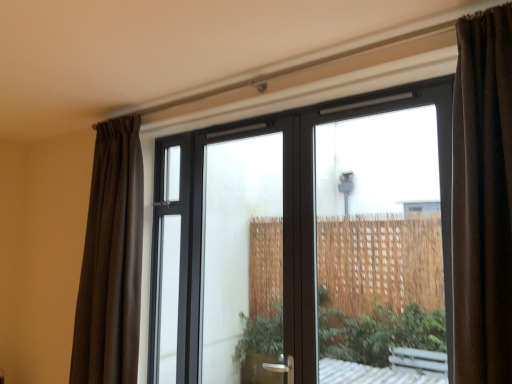
Question: Is transparent glass window at center taller or shorter than transparent glass door at center?

Choices:
 (A) short
 (B) tall

Answer: (B)

Question: Choose the correct answer: Is transparent glass window at center inside transparent glass door at center or outside it?

Choices:
 (A) outside
 (B) inside

Answer: (A)

Question: Based on their relative distances, which object is farther from the brown sheer curtain at left?

Choices:
 (A) transparent glass door at center
 (B) transparent glass window at center

Answer: (B)

Question: Which of these objects is positioned farthest from the transparent glass window at center?

Choices:
 (A) brown sheer curtain at left
 (B) transparent glass door at center

Answer: (A)